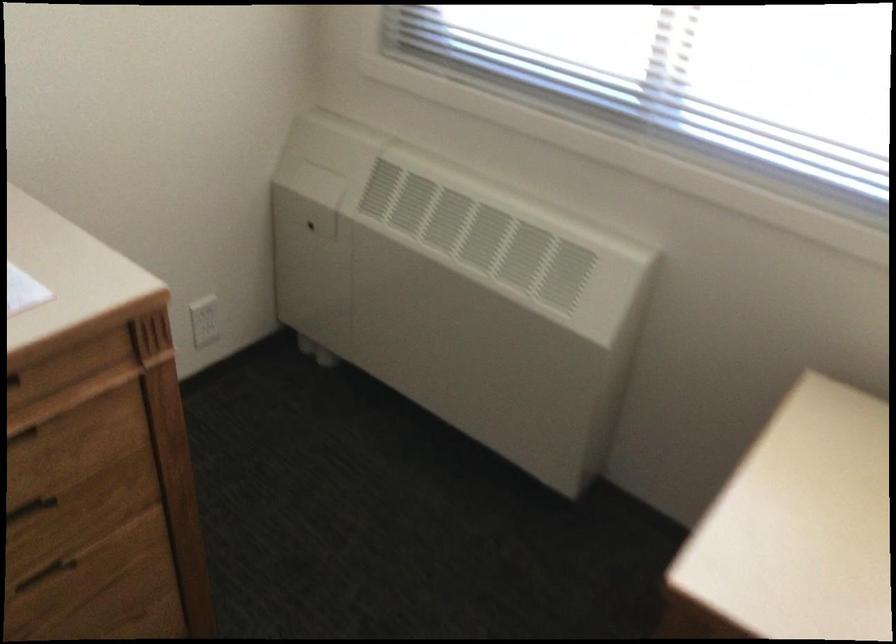
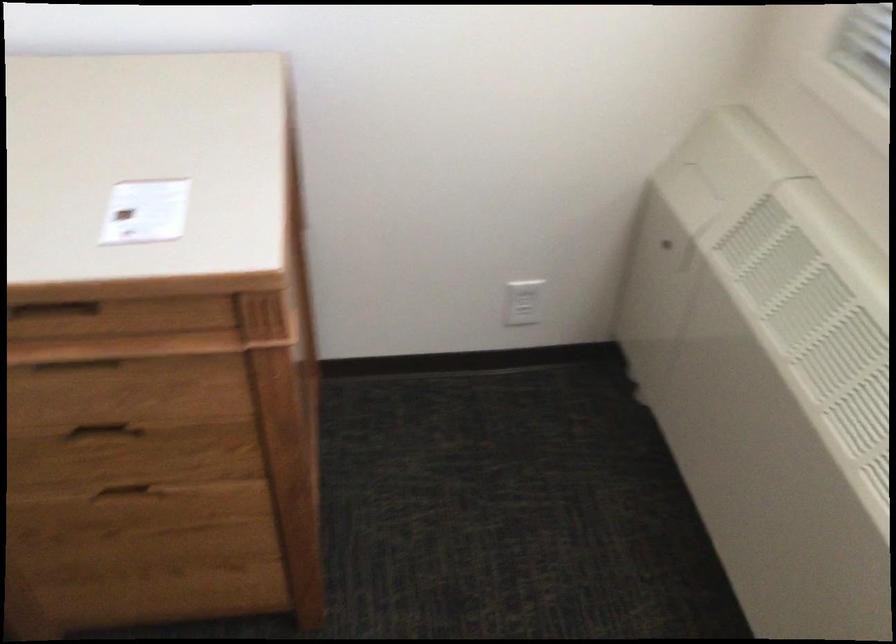
Question: The images are taken continuously from a first-person perspective. In which direction is your viewpoint rotating?

Choices:
 (A) Left
 (B) Right
 (C) Up
 (D) Down

Answer: (A)